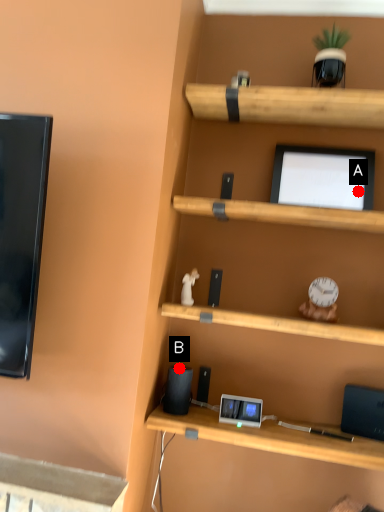
Question: Two points are circled on the image, labeled by A and B beside each circle. Which point is closer to the camera taking this photo?

Choices:
 (A) A is closer
 (B) B is closer

Answer: (A)